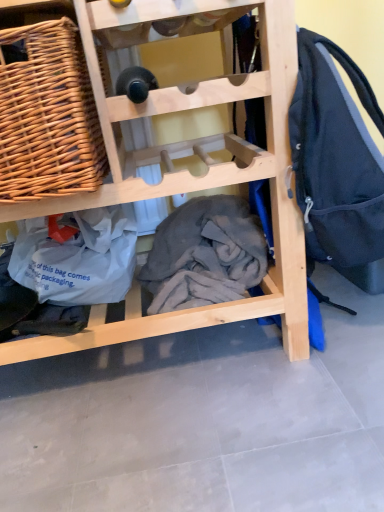
Question: Is natural wood wine rack at center placed right next to gray cotton blanket at center?

Choices:
 (A) no
 (B) yes

Answer: (A)

Question: Is natural wood wine rack at center positioned far away from gray cotton blanket at center?

Choices:
 (A) yes
 (B) no

Answer: (B)

Question: Can you confirm if natural wood wine rack at center is positioned to the right of gray cotton blanket at center?

Choices:
 (A) yes
 (B) no

Answer: (B)

Question: Can you confirm if natural wood wine rack at center is positioned to the left of gray cotton blanket at center?

Choices:
 (A) yes
 (B) no

Answer: (A)

Question: From the image's perspective, is natural wood wine rack at center beneath gray cotton blanket at center?

Choices:
 (A) no
 (B) yes

Answer: (A)

Question: Considering the relative sizes of natural wood wine rack at center and gray cotton blanket at center in the image provided, is natural wood wine rack at center taller than gray cotton blanket at center?

Choices:
 (A) no
 (B) yes

Answer: (B)

Question: Could you tell me if natural wood wine rack at center is turned towards woven wood picnic basket at upper left?

Choices:
 (A) no
 (B) yes

Answer: (B)

Question: Is natural wood wine rack at center thinner than woven wood picnic basket at upper left?

Choices:
 (A) yes
 (B) no

Answer: (B)

Question: Does natural wood wine rack at center have a smaller size compared to woven wood picnic basket at upper left?

Choices:
 (A) yes
 (B) no

Answer: (B)

Question: Is natural wood wine rack at center directly adjacent to woven wood picnic basket at upper left?

Choices:
 (A) yes
 (B) no

Answer: (B)

Question: Is the depth of natural wood wine rack at center greater than that of woven wood picnic basket at upper left?

Choices:
 (A) no
 (B) yes

Answer: (A)

Question: From the image's perspective, would you say natural wood wine rack at center is shown under woven wood picnic basket at upper left?

Choices:
 (A) no
 (B) yes

Answer: (B)

Question: Does woven wood picnic basket at upper left have a greater width compared to natural wood wine rack at center?

Choices:
 (A) no
 (B) yes

Answer: (A)